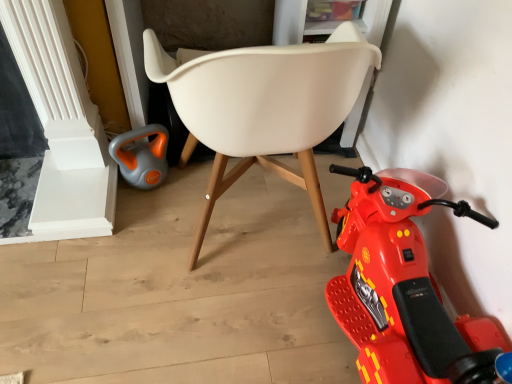
This screenshot has width=512, height=384. What are the coordinates of `free space between gray-orange plastic kettle at lower left and white plastic chair at center` in the screenshot? It's located at (158, 228).